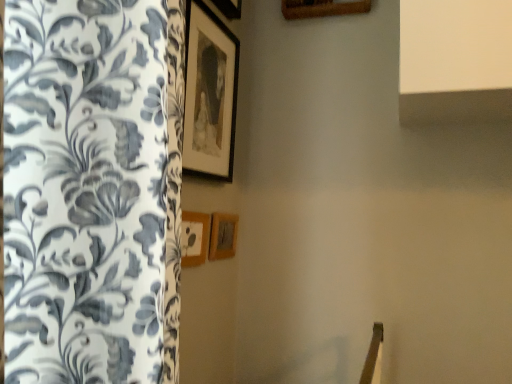
Question: Is wooden picture frame at center, which is the 2th picture frame in bottom-to-top order, at the back of matte black picture frame at upper center, which is the first picture frame in top-to-bottom order?

Choices:
 (A) no
 (B) yes

Answer: (A)

Question: Is matte black picture frame at upper center, the 3th picture frame ordered from the bottom, outside of wooden picture frame at center, which is the 2th picture frame in bottom-to-top order?

Choices:
 (A) yes
 (B) no

Answer: (A)

Question: Is the depth of matte black picture frame at upper center, which is the first picture frame in top-to-bottom order, greater than that of wooden picture frame at center, which is the 2th picture frame in bottom-to-top order?

Choices:
 (A) no
 (B) yes

Answer: (A)

Question: From a real-world perspective, is matte black picture frame at upper center, which is the first picture frame in top-to-bottom order, on wooden picture frame at center, which ranks as the second picture frame in top-to-bottom order?

Choices:
 (A) yes
 (B) no

Answer: (A)

Question: Would you say wooden picture frame at center, which ranks as the second picture frame in top-to-bottom order, is part of matte black picture frame at upper center, the 3th picture frame ordered from the bottom,'s contents?

Choices:
 (A) yes
 (B) no

Answer: (B)

Question: Considering their positions, is wooden picture frame at center, which ranks as the second picture frame in top-to-bottom order, located in front of or behind matte black picture frame at upper center, the 3th picture frame ordered from the bottom?

Choices:
 (A) front
 (B) behind

Answer: (B)

Question: Is wooden picture frame at center, which is the 2th picture frame in bottom-to-top order, inside or outside of matte black picture frame at upper center, the 3th picture frame ordered from the bottom?

Choices:
 (A) inside
 (B) outside

Answer: (B)

Question: Considering the positions of wooden picture frame at center, which is the 2th picture frame in bottom-to-top order, and matte black picture frame at upper center, which is the first picture frame in top-to-bottom order, in the image, is wooden picture frame at center, which is the 2th picture frame in bottom-to-top order, wider or thinner than matte black picture frame at upper center, which is the first picture frame in top-to-bottom order,?

Choices:
 (A) thin
 (B) wide

Answer: (A)

Question: From a real-world perspective, is wooden picture frame at center, which ranks as the second picture frame in top-to-bottom order, physically located above or below matte black picture frame at upper center, the 3th picture frame ordered from the bottom?

Choices:
 (A) above
 (B) below

Answer: (B)

Question: Is point (208, 94) closer or farther from the camera than point (195, 248)?

Choices:
 (A) closer
 (B) farther

Answer: (B)

Question: Is matte black picture frame at upper center, which is the first picture frame in top-to-bottom order, taller or shorter than wooden picture frame at center, which is the 2th picture frame in bottom-to-top order?

Choices:
 (A) tall
 (B) short

Answer: (A)

Question: Is matte black picture frame at upper center, which is the first picture frame in top-to-bottom order, bigger or smaller than wooden picture frame at center, which ranks as the second picture frame in top-to-bottom order?

Choices:
 (A) small
 (B) big

Answer: (B)

Question: From a real-world perspective, is matte black picture frame at upper center, which is the first picture frame in top-to-bottom order, positioned above or below wooden picture frame at center, which is the 2th picture frame in bottom-to-top order?

Choices:
 (A) below
 (B) above

Answer: (B)

Question: Considering the positions of matte black picture frame at upper center, the 3th picture frame ordered from the bottom, and wooden picture frame at center, the 1th picture frame in the bottom-to-top sequence, in the image, is matte black picture frame at upper center, the 3th picture frame ordered from the bottom, taller or shorter than wooden picture frame at center, the 1th picture frame in the bottom-to-top sequence,?

Choices:
 (A) short
 (B) tall

Answer: (B)

Question: In the image, is matte black picture frame at upper center, which is the first picture frame in top-to-bottom order, positioned in front of or behind wooden picture frame at center, the 1th picture frame in the bottom-to-top sequence?

Choices:
 (A) behind
 (B) front

Answer: (B)